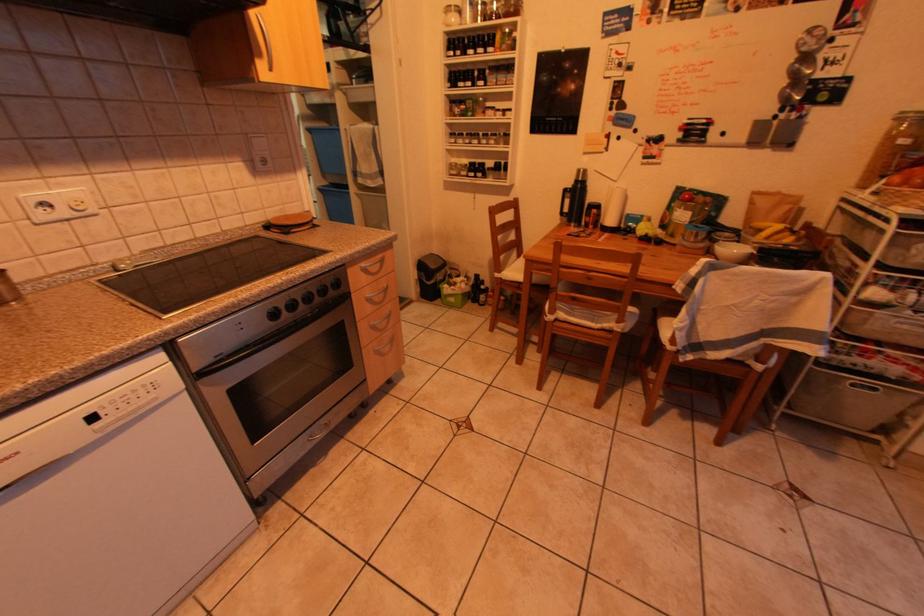
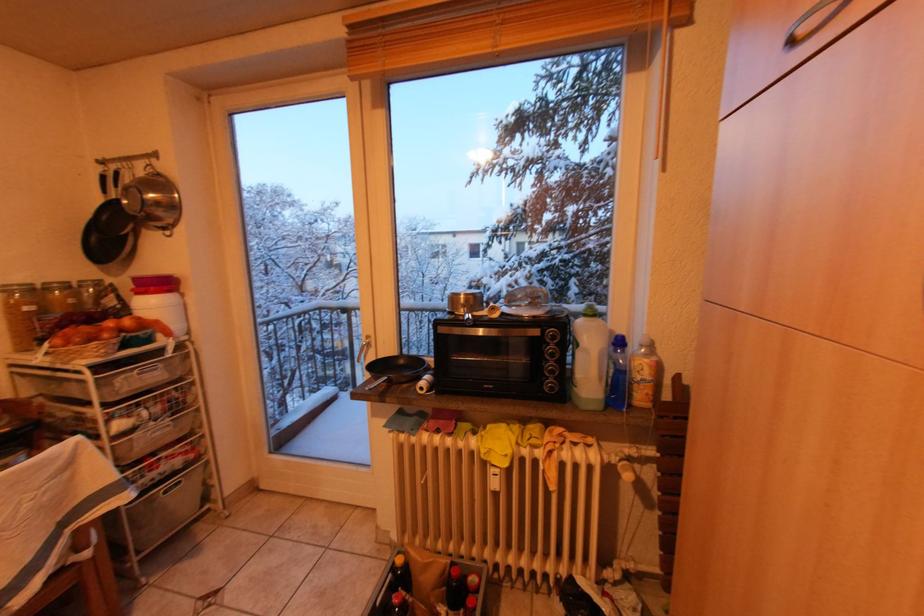
How did the camera likely rotate?

The camera rotated toward right-down.